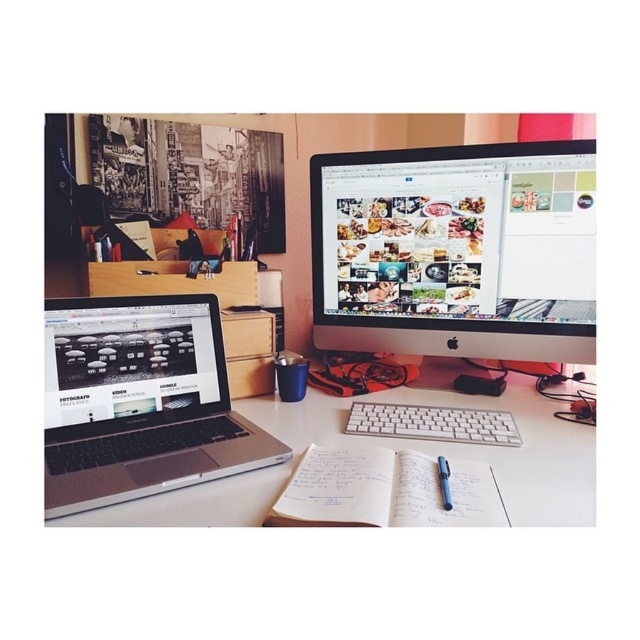
Question: Is satin black laptop at lower left smaller than black plastic pen at center?

Choices:
 (A) no
 (B) yes

Answer: (A)

Question: Which of these objects is positioned closest to the sleek silver laptop at lower left?

Choices:
 (A) black plastic pen at center
 (B) white plastic keyboard at center

Answer: (B)

Question: Which point is closer to the camera?

Choices:
 (A) (97, 333)
 (B) (193, 397)
 (C) (358, 300)

Answer: (A)

Question: Does white paper notebook at center appear on the right side of white plastic keyboard at center?

Choices:
 (A) no
 (B) yes

Answer: (A)

Question: Which point is farther to the camera?

Choices:
 (A) (51, 435)
 (B) (390, 500)
 (C) (432, 291)

Answer: (C)

Question: Where is satin black monitor at upper center located in relation to sleek silver laptop at lower left in the image?

Choices:
 (A) below
 (B) above

Answer: (B)